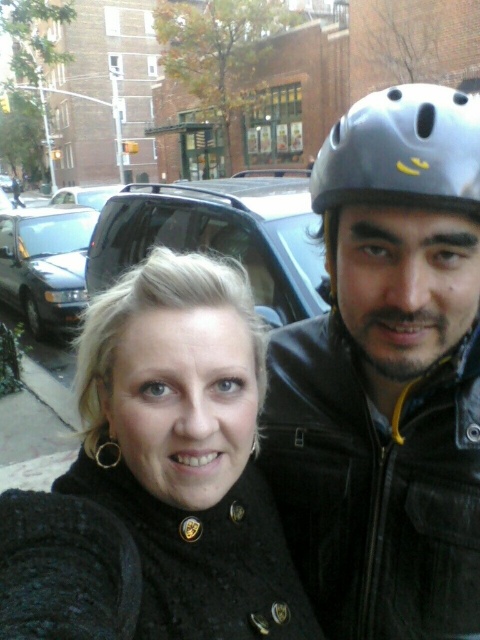
Who is higher up, gray matte helmet at upper right or shiny black sedan at left?

shiny black sedan at left

Is gray matte helmet at upper right thinner than shiny black sedan at left?

Indeed, gray matte helmet at upper right has a lesser width compared to shiny black sedan at left.

Which is in front, point (322, 150) or point (36, 252)?

Positioned in front is point (322, 150).

Image resolution: width=480 pixels, height=640 pixels. In order to click on gray matte helmet at upper right in this screenshot , I will do `click(399, 157)`.

Is shiny black sedan at left taller than matte black car at center?

No.

Between point (63, 240) and point (64, 202), which one is positioned behind?

Positioned behind is point (64, 202).

Is point (62, 260) farther from viewer compared to point (84, 196)?

No, (62, 260) is in front of (84, 196).

This screenshot has height=640, width=480. In order to click on shiny black sedan at left in this screenshot , I will do `click(46, 266)`.

Is matte black helmet at upper right above matte gray helmet at upper right?

Incorrect, matte black helmet at upper right is not positioned above matte gray helmet at upper right.

Who is shorter, matte black helmet at upper right or matte gray helmet at upper right?

Standing shorter between the two is matte gray helmet at upper right.

Does point (396, 513) come closer to viewer compared to point (384, 106)?

That is False.

Where is `matte black helmet at upper right`? matte black helmet at upper right is located at coordinates (386, 376).